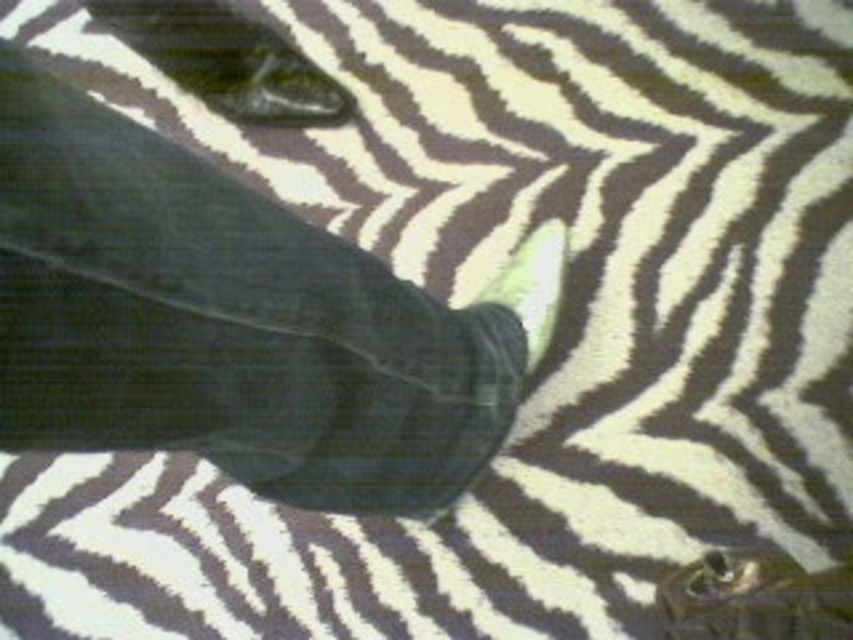
You are a photographer trying to capture the zebra in the image. You notice the dark gray fabric at center and the white soft foot at center in your frame. Which object should you adjust your focus on if you want to ensure the larger object is in sharp focus?

The dark gray fabric at center is bigger than the white soft foot at center, so you should adjust your focus on the dark gray fabric at center to ensure the larger object is in sharp focus.

Based on the scene description, which object is wider, the matte black shoe at upper left or the white soft foot at center?

The matte black shoe at upper left is wider than the white soft foot at center according to the description.

You are a photographer trying to capture the zebra in the image. You notice a dark gray fabric at center located at point (236,321). Is this fabric part of the zebra or something else?

The dark gray fabric at center located at point (236,321) is part of the zebra, as it is described as being at the center of the image where the zebra is focused.